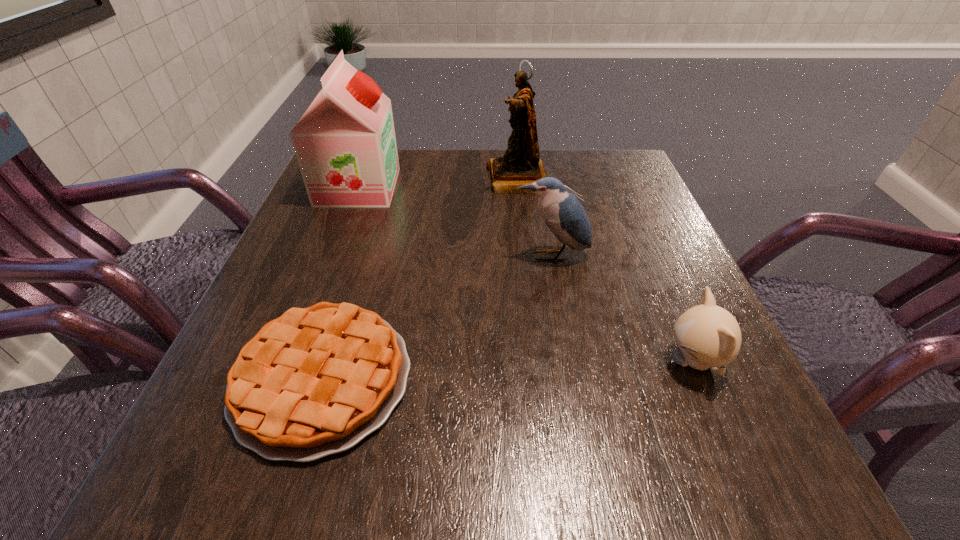
The image size is (960, 540). In order to click on pie positioned at the left edge in this screenshot , I will do `click(316, 381)`.

Image resolution: width=960 pixels, height=540 pixels. I want to click on object positioned at the right edge, so click(x=708, y=336).

At what (x,y) coordinates should I click in order to perform the action: click on object that is at the far left corner. Please return your answer as a coordinate pair (x, y). The height and width of the screenshot is (540, 960). Looking at the image, I should click on (345, 144).

Find the location of `object that is positioned at the near left corner`. object that is positioned at the near left corner is located at coordinates (316, 381).

In the image, there is a desktop. In order to click on vacant space at the far edge in this screenshot , I will do `click(462, 178)`.

Identify the location of vacant space at the left edge. (332, 287).

At what (x,y) coordinates should I click in order to perform the action: click on blank area at the far right corner. Please return your answer as a coordinate pair (x, y). The width and height of the screenshot is (960, 540). Looking at the image, I should click on (588, 157).

At what (x,y) coordinates should I click in order to perform the action: click on free point between the shortest object and the figurine. Please return your answer as a coordinate pair (x, y). Looking at the image, I should click on (420, 279).

Locate an element on the screen. The height and width of the screenshot is (540, 960). empty space that is in between the shortest object and the bird is located at coordinates (437, 317).

Locate an element on the screen. free spot between the shortest object and the bird is located at coordinates (437, 317).